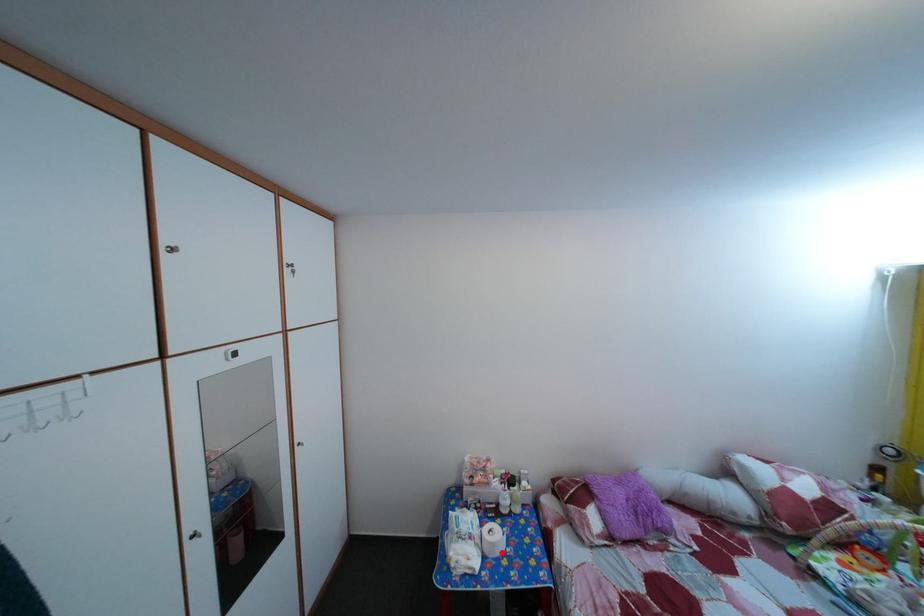
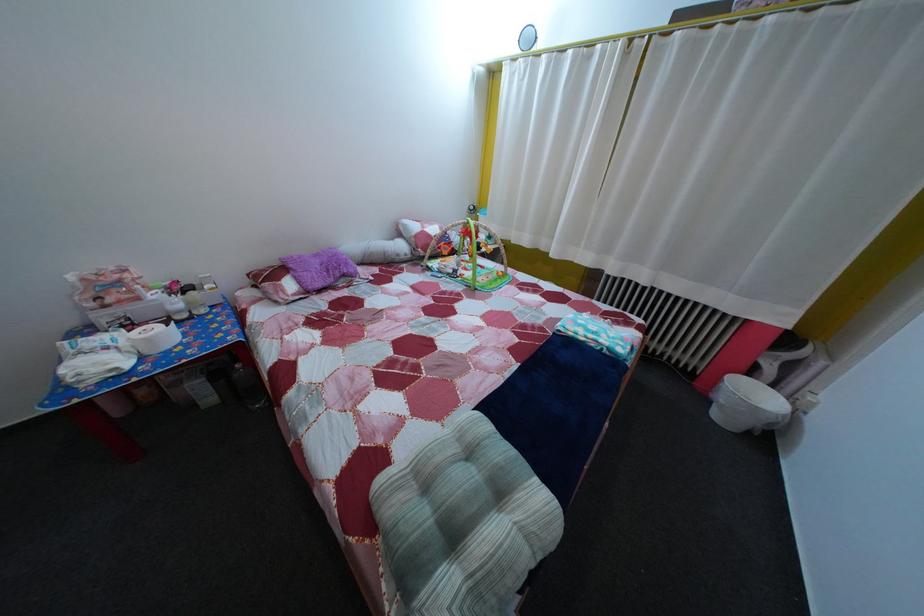
Question: I am providing you with two images of the same scene from different viewpoints. A red point is shown in image1. For the corresponding object point in image2, is it positioned nearer or farther from the camera?

Choices:
 (A) Nearer
 (B) Farther

Answer: (B)